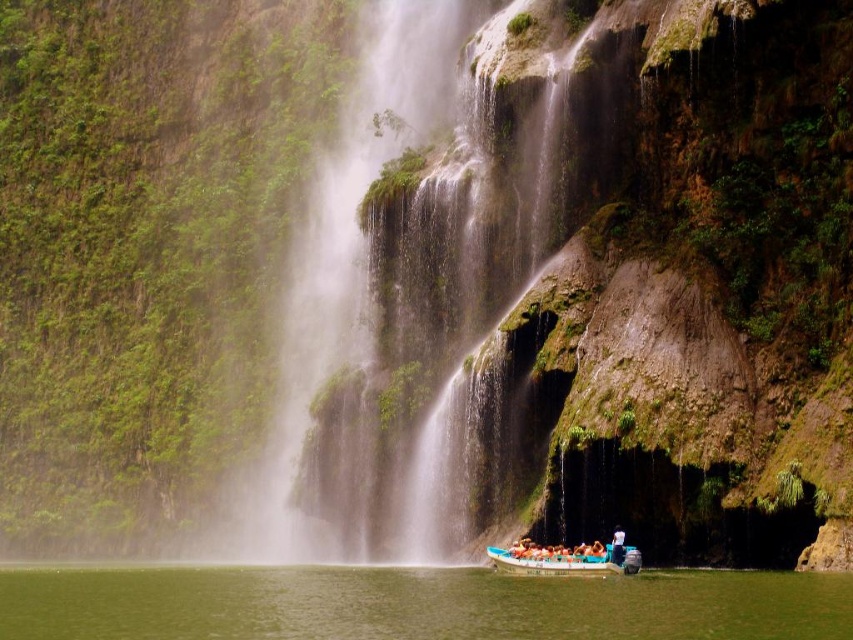
You are a tourist standing in the boat and want to take a photo of the green mossy rock at center and the white cotton shirt at lower center. Which object should you point your camera towards first if you want to capture both in one shot?

You should point your camera towards the white cotton shirt at lower center first because the green mossy rock at center is to the left of it, allowing both to be captured in the frame.

You are a tour guide on the blue plastic boat at center. You notice a passenger wearing a white cotton shirt at lower center. Can you safely reach them to hand them a life jacket?

The blue plastic boat at center has a greater height compared to the white cotton shirt at lower center. Since the boat is taller, it might be difficult to reach the passenger wearing the white cotton shirt at lower center unless you step down or they come closer.

You are a tour guide leading a group near the waterfall. Your boat, the blue plastic boat at center, needs to navigate around the green mossy rock at center. According to the scene, which direction should you steer the boat to avoid the rock?

The green mossy rock at center is to the left of the blue plastic boat at center, so you should steer the boat to the right to avoid the rock.